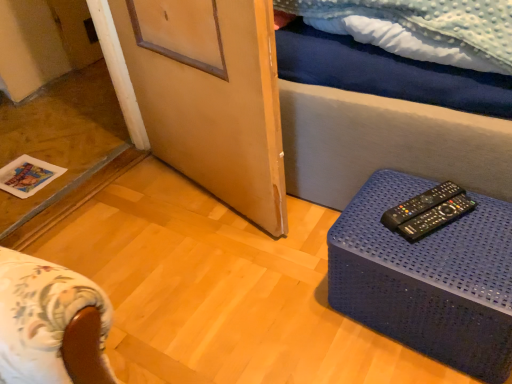
You are a GUI agent. You are given a task and a screenshot of the screen. Output one action in this format:
    pyautogui.click(x=<x>, y=<y>)
    Task: Click on the free point in front of black plastic remote controls at right, which ranks as the 1th remote control in front-to-back order
    
    Given the screenshot: What is the action you would take?
    pyautogui.click(x=458, y=260)